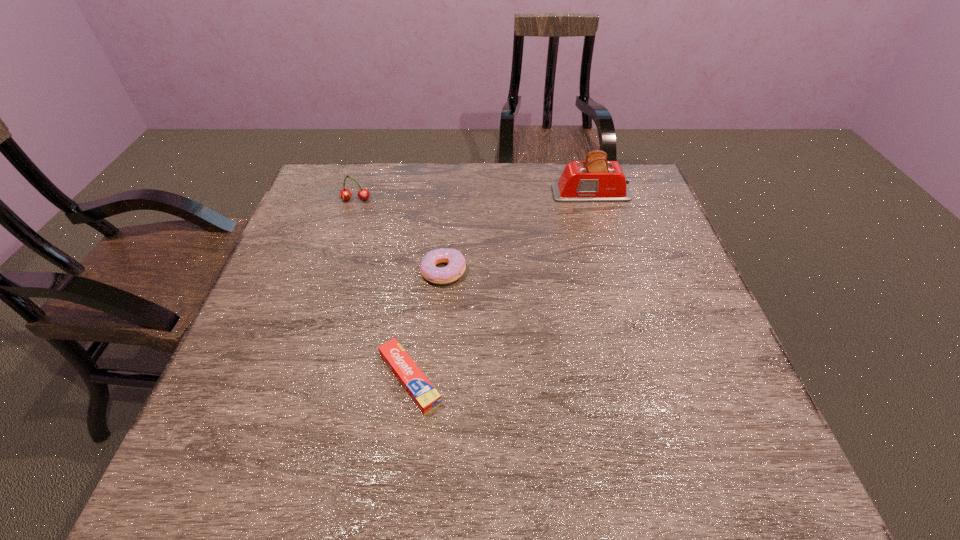
I want to click on vacant space at the right edge of the desktop, so click(x=637, y=260).

At what (x,y) coordinates should I click in order to perform the action: click on free region at the far left corner of the desktop. Please return your answer as a coordinate pair (x, y). Image resolution: width=960 pixels, height=540 pixels. Looking at the image, I should click on (355, 173).

Locate an element on the screen. Image resolution: width=960 pixels, height=540 pixels. free spot between the rightmost object and the toothpaste is located at coordinates [500, 286].

Find the location of a particular element. This screenshot has height=540, width=960. unoccupied position between the tallest object and the nearest object is located at coordinates (500, 286).

Where is `free space between the leftmost object and the toaster`? This screenshot has width=960, height=540. free space between the leftmost object and the toaster is located at coordinates (473, 197).

The width and height of the screenshot is (960, 540). In order to click on empty location between the toaster and the doughnut in this screenshot , I will do `click(517, 232)`.

This screenshot has width=960, height=540. In order to click on unoccupied position between the third shortest object and the toothpaste in this screenshot , I will do pos(383,289).

At what (x,y) coordinates should I click in order to perform the action: click on free space between the leftmost object and the doughnut. Please return your answer as a coordinate pair (x, y). The height and width of the screenshot is (540, 960). Looking at the image, I should click on (399, 235).

Find the location of a particular element. free area in between the leftmost object and the third tallest object is located at coordinates (399, 235).

Where is `free space between the second nearest object and the shortest object`? This screenshot has width=960, height=540. free space between the second nearest object and the shortest object is located at coordinates (426, 325).